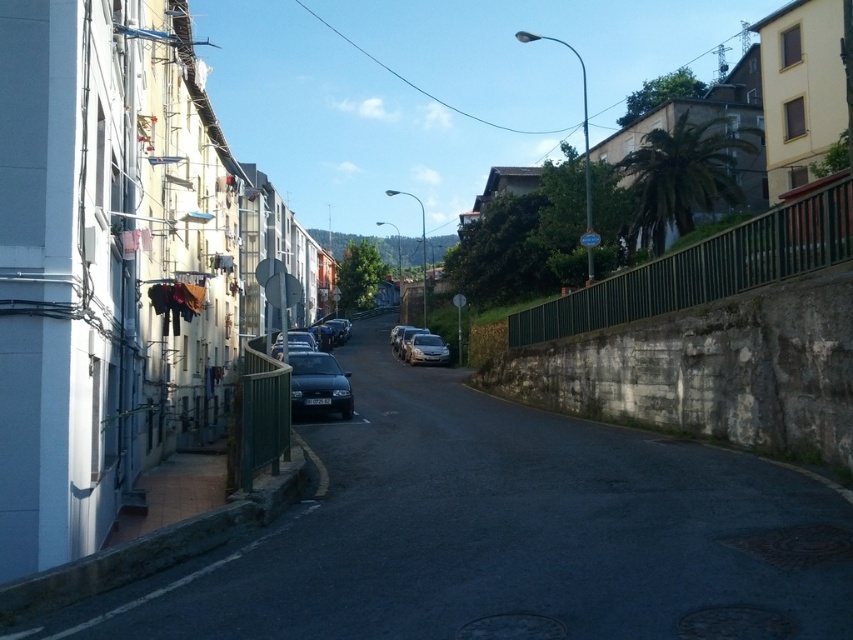
Question: Can you confirm if smooth asphalt road at center is thinner than satin silver car at center?

Choices:
 (A) yes
 (B) no

Answer: (B)

Question: From the image, what is the correct spatial relationship of smooth asphalt road at center in relation to satin silver car at center?

Choices:
 (A) left
 (B) right

Answer: (B)

Question: Does smooth asphalt road at center appear on the left side of satin black car at center?

Choices:
 (A) yes
 (B) no

Answer: (B)

Question: Which object is closer to the camera taking this photo?

Choices:
 (A) smooth asphalt road at center
 (B) satin silver car at center

Answer: (A)

Question: Which of these objects is positioned farthest from the satin silver car at center?

Choices:
 (A) smooth asphalt road at center
 (B) satin black car at center

Answer: (A)

Question: Among these objects, which one is farthest from the camera?

Choices:
 (A) satin black car at center
 (B) satin silver car at center

Answer: (B)